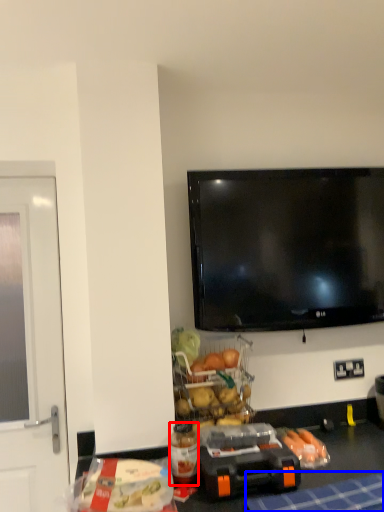
Question: Which point is closer to the camera, bottle (highlighted by a red box) or tablecloth (highlighted by a blue box)?

Choices:
 (A) bottle
 (B) tablecloth

Answer: (B)